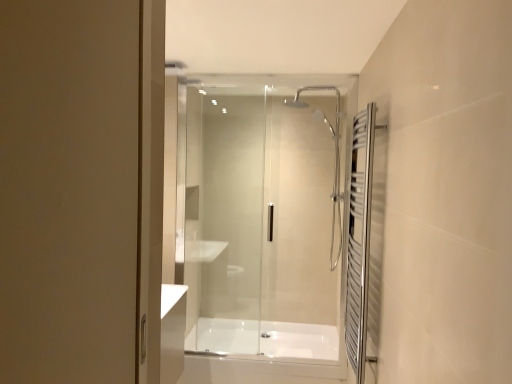
Question: Choose the correct answer: Is white glossy bathtub at center inside polished chrome towel rack at right or outside it?

Choices:
 (A) outside
 (B) inside

Answer: (A)

Question: Looking at the image, does white glossy bathtub at center seem bigger or smaller compared to polished chrome towel rack at right?

Choices:
 (A) small
 (B) big

Answer: (B)

Question: Estimate the real-world distances between objects in this image. Which object is closer to the polished chrome towel rack at right?

Choices:
 (A) transparent glass shower door at center
 (B) white glossy bathtub at center

Answer: (A)

Question: Which object is positioned farthest from the polished chrome towel rack at right?

Choices:
 (A) white glossy bathtub at center
 (B) transparent glass shower door at center

Answer: (A)